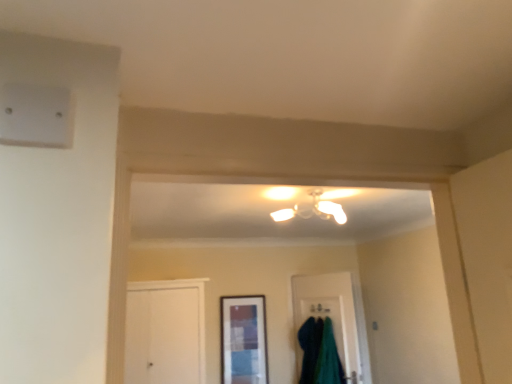
This screenshot has height=384, width=512. Describe the element at coordinates (336, 315) in the screenshot. I see `green fabric at lower center` at that location.

Identify the location of matte glass window at center. (244, 340).

This screenshot has width=512, height=384. What are the coordinates of `matte white chandelier at center` in the screenshot? It's located at (313, 210).

Where is `green fabric at lower center`? The width and height of the screenshot is (512, 384). green fabric at lower center is located at coordinates (336, 315).

Which object is positioned more to the right, teal fuzzy robe at lower center or matte white chandelier at center?

teal fuzzy robe at lower center.

Which is behind, teal fuzzy robe at lower center or matte white chandelier at center?

teal fuzzy robe at lower center is more distant.

Where is `light fixture above the teal fuzzy robe at lower center (from a real-world perspective)`? The width and height of the screenshot is (512, 384). light fixture above the teal fuzzy robe at lower center (from a real-world perspective) is located at coordinates point(313,210).

Does teal fuzzy robe at lower center have a greater width compared to green fabric at lower center?

Yes, teal fuzzy robe at lower center is wider than green fabric at lower center.

From a real-world perspective, is teal fuzzy robe at lower center positioned under green fabric at lower center based on gravity?

Yes, from a real-world perspective, teal fuzzy robe at lower center is under green fabric at lower center.

Visually, is teal fuzzy robe at lower center positioned to the left or to the right of green fabric at lower center?

From the image, it's evident that teal fuzzy robe at lower center is to the left of green fabric at lower center.

In the scene shown: Considering the relative sizes of teal fuzzy robe at lower center and green fabric at lower center in the image provided, is teal fuzzy robe at lower center taller than green fabric at lower center?

Incorrect, the height of teal fuzzy robe at lower center is not larger of that of green fabric at lower center.

Is matte glass window at center not near teal fuzzy robe at lower center?

They are positioned close to each other.

Between point (237, 344) and point (309, 320), which one is positioned behind?

The point (309, 320) is behind.

From a real-world perspective, who is located lower, matte glass window at center or teal fuzzy robe at lower center?

teal fuzzy robe at lower center is physically lower.

Considering the relative sizes of matte glass window at center and teal fuzzy robe at lower center in the image provided, is matte glass window at center smaller than teal fuzzy robe at lower center?

Indeed, matte glass window at center has a smaller size compared to teal fuzzy robe at lower center.

In the scene shown: Is green fabric at lower center next to matte white chandelier at center?

There is a gap between green fabric at lower center and matte white chandelier at center.

Does point (312, 288) lie behind point (310, 207)?

That is True.

Is the depth of green fabric at lower center less than that of matte white chandelier at center?

No, green fabric at lower center is further to the viewer.

From a real-world perspective, is green fabric at lower center located beneath matte white chandelier at center?

Yes, from a real-world perspective, green fabric at lower center is beneath matte white chandelier at center.

Consider the image. From the image's perspective, is green fabric at lower center located above or below teal fuzzy robe at lower center?

Based on their image positions, green fabric at lower center is located above teal fuzzy robe at lower center.

Is green fabric at lower center oriented away from teal fuzzy robe at lower center?

Yes, teal fuzzy robe at lower center is at the back of green fabric at lower center.

Does green fabric at lower center lie in front of teal fuzzy robe at lower center?

No, green fabric at lower center is further to the viewer.

Is matte glass window at center oriented towards matte white chandelier at center?

Yes.

Is point (238, 346) positioned in front of point (314, 194)?

No, (238, 346) is further to viewer.

Looking at the image, does matte glass window at center seem bigger or smaller compared to matte white chandelier at center?

Considering their sizes, matte glass window at center takes up less space than matte white chandelier at center.

From a real-world perspective, between matte glass window at center and matte white chandelier at center, who is vertically lower?

In real-world perspective, matte glass window at center is lower.

In the scene shown: Can you confirm if matte white chandelier at center is positioned to the right of teal fuzzy robe at lower center?

In fact, matte white chandelier at center is to the left of teal fuzzy robe at lower center.

Is matte white chandelier at center oriented away from teal fuzzy robe at lower center?

No, matte white chandelier at center's orientation is not away from teal fuzzy robe at lower center.

Which is behind, point (274, 214) or point (306, 334)?

Positioned behind is point (306, 334).

This screenshot has width=512, height=384. What are the coordinates of `robe located underneath the matte white chandelier at center (from a real-world perspective)` in the screenshot? It's located at (319, 353).

Locate an element on the screen. The width and height of the screenshot is (512, 384). light fixture that is above the teal fuzzy robe at lower center (from a real-world perspective) is located at coordinates (313, 210).

The height and width of the screenshot is (384, 512). In order to click on robe that appears in front of the green fabric at lower center in this screenshot , I will do `click(319, 353)`.

Estimate the real-world distances between objects in this image. Which object is closer to matte white chandelier at center, teal fuzzy robe at lower center or matte glass window at center?

The object closer to matte white chandelier at center is teal fuzzy robe at lower center.

When comparing their distances from green fabric at lower center, does matte white chandelier at center or teal fuzzy robe at lower center seem further?

The object further to green fabric at lower center is matte white chandelier at center.

Looking at the image, which one is located further to matte white chandelier at center, matte glass window at center or teal fuzzy robe at lower center?

Among the two, matte glass window at center is located further to matte white chandelier at center.

When comparing their distances from teal fuzzy robe at lower center, does matte white chandelier at center or matte glass window at center seem further?

Among the two, matte white chandelier at center is located further to teal fuzzy robe at lower center.

From the picture: Based on their spatial positions, is green fabric at lower center or teal fuzzy robe at lower center further from matte glass window at center?

green fabric at lower center.

Based on their spatial positions, is green fabric at lower center or matte white chandelier at center further from matte glass window at center?

Among the two, matte white chandelier at center is located further to matte glass window at center.

Looking at the image, which one is located further to teal fuzzy robe at lower center, matte glass window at center or matte white chandelier at center?

The object further to teal fuzzy robe at lower center is matte white chandelier at center.

Based on their spatial positions, is green fabric at lower center or matte glass window at center closer to teal fuzzy robe at lower center?

green fabric at lower center.

Where is `robe situated between matte glass window at center and green fabric at lower center from left to right`? The height and width of the screenshot is (384, 512). robe situated between matte glass window at center and green fabric at lower center from left to right is located at coordinates (319, 353).

Where is `door between matte white chandelier at center and matte glass window at center in the front-back direction`? The height and width of the screenshot is (384, 512). door between matte white chandelier at center and matte glass window at center in the front-back direction is located at coordinates (336, 315).

This screenshot has width=512, height=384. I want to click on robe between matte white chandelier at center and green fabric at lower center along the z-axis, so click(319, 353).

What are the coordinates of `robe between matte white chandelier at center and matte glass window at center along the z-axis` in the screenshot? It's located at (319, 353).